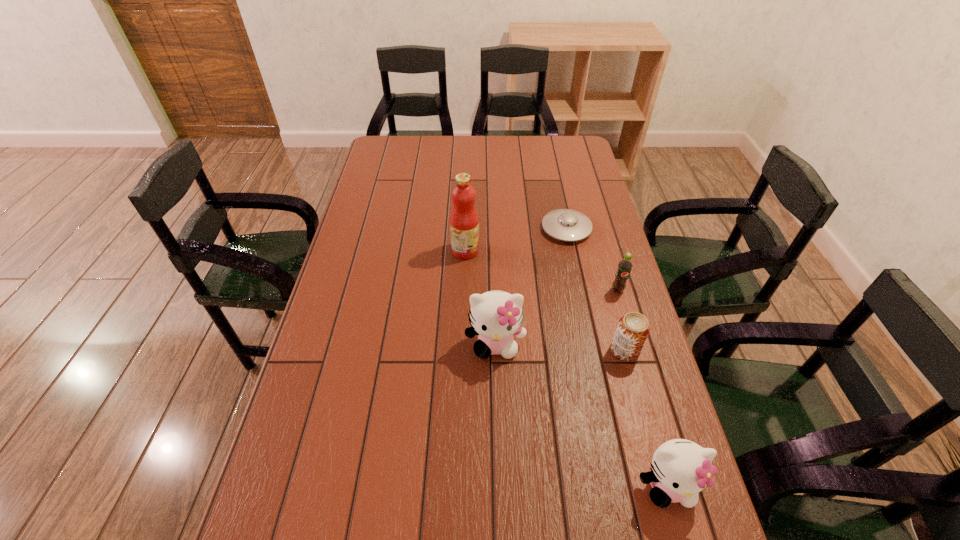
The width and height of the screenshot is (960, 540). Identify the location of vacant area at the near edge. (476, 538).

You are a GUI agent. You are given a task and a screenshot of the screen. Output one action in this format:
    pyautogui.click(x=<x>, y=<y>)
    Task: Click on the free region at the left edge of the desktop
    The height and width of the screenshot is (540, 960).
    Given the screenshot: What is the action you would take?
    pyautogui.click(x=345, y=402)

The width and height of the screenshot is (960, 540). Identify the location of vacant space at the right edge of the desktop. (568, 185).

Locate an element on the screen. The height and width of the screenshot is (540, 960). vacant space at the far right corner of the desktop is located at coordinates (559, 164).

This screenshot has height=540, width=960. I want to click on free region at the near right corner of the desktop, so click(x=638, y=532).

Where is `vacant space that's between the fifth tallest object and the fifth shortest object`? This screenshot has height=540, width=960. vacant space that's between the fifth tallest object and the fifth shortest object is located at coordinates (560, 347).

Find the location of a particular element. This screenshot has height=540, width=960. empty space between the nearer kitten and the taller kitten is located at coordinates (582, 415).

Find the location of a particular element. The height and width of the screenshot is (540, 960). blank region between the fruit juice and the fourth nearest object is located at coordinates (541, 271).

The width and height of the screenshot is (960, 540). In order to click on free space between the shortest object and the third farthest object in this screenshot , I will do `click(592, 260)`.

The height and width of the screenshot is (540, 960). I want to click on unoccupied area between the nearest object and the beer can, so click(646, 418).